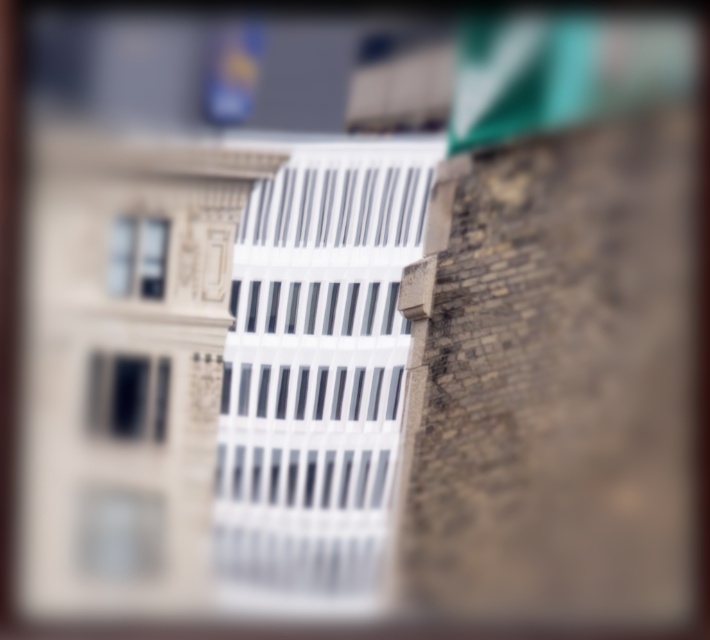
Question: Is matte black window at center below clear glass window at upper left?

Choices:
 (A) yes
 (B) no

Answer: (A)

Question: Is matte black window at center in front of clear glass window at upper left?

Choices:
 (A) no
 (B) yes

Answer: (B)

Question: Is matte black window at center thinner than clear glass window at upper left?

Choices:
 (A) no
 (B) yes

Answer: (A)

Question: Which point is farther to the camera?

Choices:
 (A) (155, 413)
 (B) (133, 224)

Answer: (B)

Question: Among these objects, which one is nearest to the camera?

Choices:
 (A) matte black window at center
 (B) clear glass window at upper left

Answer: (A)